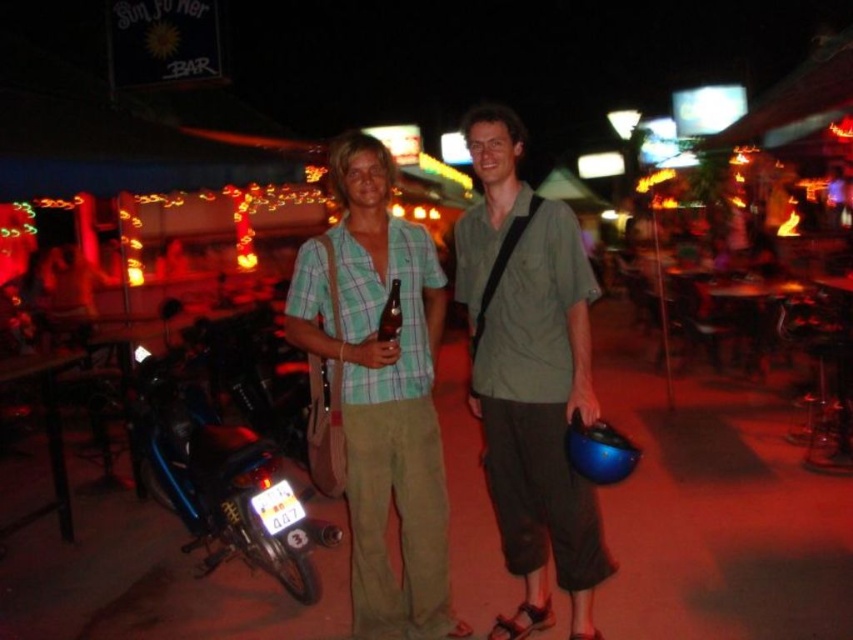
You are standing at the point with coordinates point (328, 531) and want to move to the exit located at point (474, 227). Is the exit in front of you or behind you?

The exit at point (474, 227) is in front of you because it is located in front of point (328, 531) where you are standing.

You are standing in the bar scene and want to find the green cotton shirt at center. Which direction should you look to find it?

The green cotton shirt at center is located at the coordinates 0.588 on the x axis and 0.621 on the y axis, so you should look towards the center of the image to find it.